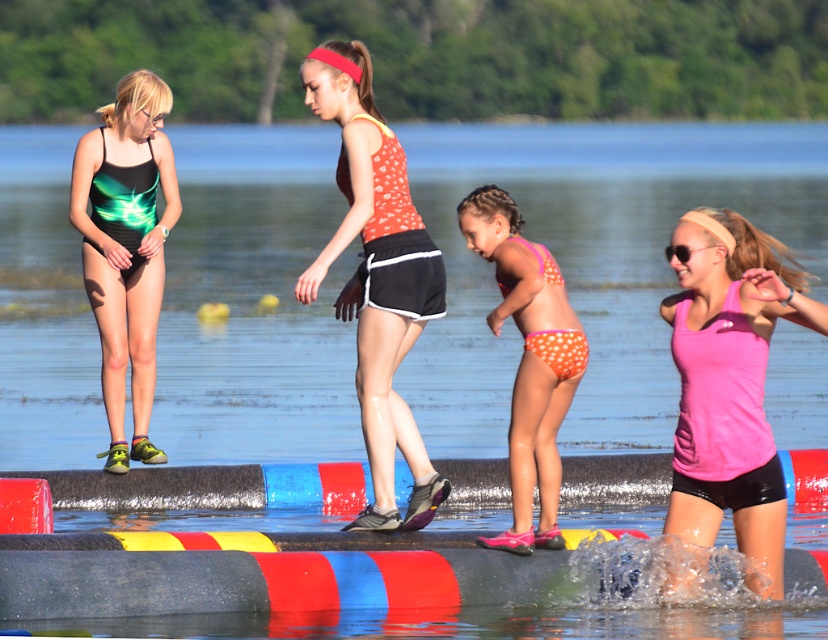
You are a photographer taking a picture of the green iridescent swimsuit at left and the orange polka dot bikini at center. Which swimwear will reflect more light in the photo?

The green iridescent swimsuit at left is positioned under the orange polka dot bikini at center, so it may reflect more light depending on the angle, but the description does not specify light reflection properties. However, since iridescent materials typically reflect light in multiple directions, the green iridescent swimsuit at left might appear shinier in the photo.

You are a photographer trying to capture a candid shot of the two people in the scene. You have a camera with a 1.2 meter wide lens. The pink matte tank top at center and the green iridescent swimsuit at left are standing next to each other. Can you fit both of them in your shot without moving the camera?

The pink matte tank top at center is thinner than the green iridescent swimsuit at left. Since the total width of both individuals would be less than 1.2 meters, the photographer can fit both in the shot without moving the camera.